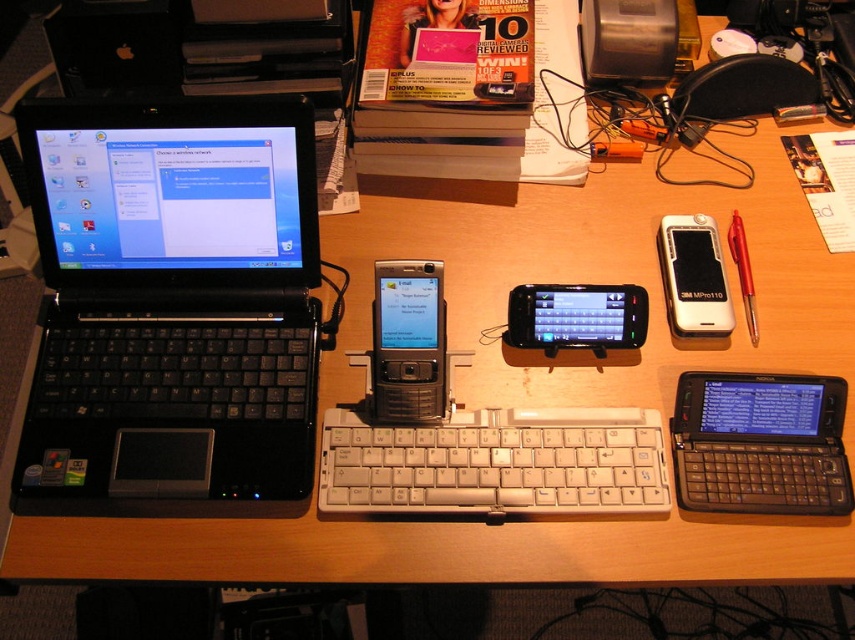
Question: Which point is farther to the camera?

Choices:
 (A) (413, 376)
 (B) (740, 256)
 (C) (559, 456)

Answer: (B)

Question: Can you confirm if black plastic laptop at left is smaller than white plastic phone at center?

Choices:
 (A) yes
 (B) no

Answer: (B)

Question: Which of the following is the farthest from the observer?

Choices:
 (A) metallic silver phone at center
 (B) red plastic pen at right
 (C) black plastic smartphone at center
 (D) black plastic laptop at left

Answer: (B)

Question: Is black plastic laptop at left thinner than black plastic smartphone at center?

Choices:
 (A) yes
 (B) no

Answer: (B)

Question: Considering the real-world distances, which object is farthest from the metallic silver phone at center?

Choices:
 (A) black plastic laptop at left
 (B) black plastic smartphone at center
 (C) black plastic laptop at center

Answer: (C)

Question: Does metallic silver phone at center appear on the left side of white plastic phone at center?

Choices:
 (A) no
 (B) yes

Answer: (B)